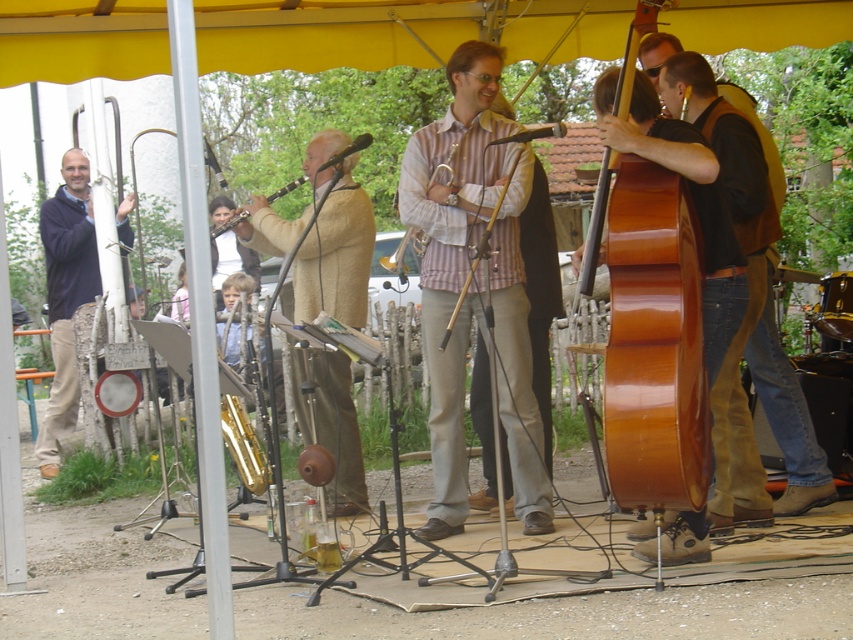
Question: Is striped cotton shirt at center behind wooden cello at center?

Choices:
 (A) no
 (B) yes

Answer: (B)

Question: Which point is farther to the camera?

Choices:
 (A) light beige wool sweater at center
 (B) shiny brown cello at center
 (C) matte blue sweater at left

Answer: (C)

Question: Observing the image, what is the correct spatial positioning of light beige wool sweater at center in reference to matte blue sweater at left?

Choices:
 (A) above
 (B) below

Answer: (B)

Question: Which of the following is the farthest from the observer?

Choices:
 (A) wooden cello at center
 (B) matte wood clarinet at center
 (C) striped cotton shirt at center
 (D) light beige wool sweater at center

Answer: (D)

Question: Which object is positioned closest to the shiny brown cello at center?

Choices:
 (A) matte blue sweater at left
 (B) matte wood clarinet at center
 (C) wooden cello at center
 (D) striped cotton shirt at center

Answer: (C)

Question: Does matte blue sweater at left appear on the right side of wooden cello at center?

Choices:
 (A) no
 (B) yes

Answer: (A)